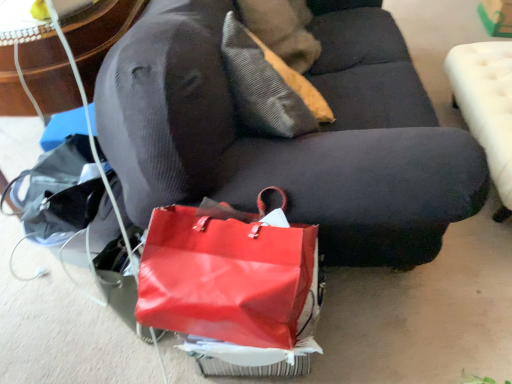
Question: Is textured beige pillow at upper center placed right next to velvet dark gray couch at center?

Choices:
 (A) yes
 (B) no

Answer: (B)

Question: Is textured beige pillow at upper center positioned behind velvet dark gray couch at center?

Choices:
 (A) no
 (B) yes

Answer: (B)

Question: Is velvet dark gray couch at center surrounded by textured beige pillow at upper center?

Choices:
 (A) no
 (B) yes

Answer: (A)

Question: From the image's perspective, does textured beige pillow at upper center appear higher than velvet dark gray couch at center?

Choices:
 (A) no
 (B) yes

Answer: (B)

Question: Is textured beige pillow at upper center taller than velvet dark gray couch at center?

Choices:
 (A) no
 (B) yes

Answer: (A)

Question: In the image, is shiny red handbag at lower center on the left side or the right side of textured beige pillow at upper center?

Choices:
 (A) left
 (B) right

Answer: (A)

Question: From the image's perspective, is shiny red handbag at lower center located above or below textured beige pillow at upper center?

Choices:
 (A) below
 (B) above

Answer: (A)

Question: Is point (210, 336) closer or farther from the camera than point (304, 109)?

Choices:
 (A) farther
 (B) closer

Answer: (B)

Question: Considering the positions of shiny red handbag at lower center and textured beige pillow at upper center in the image, is shiny red handbag at lower center wider or thinner than textured beige pillow at upper center?

Choices:
 (A) wide
 (B) thin

Answer: (A)

Question: Considering the relative positions of textured beige pillow at upper center and velvet dark gray couch at center in the image provided, is textured beige pillow at upper center to the left or to the right of velvet dark gray couch at center?

Choices:
 (A) left
 (B) right

Answer: (A)

Question: Considering the positions of textured beige pillow at upper center and velvet dark gray couch at center in the image, is textured beige pillow at upper center bigger or smaller than velvet dark gray couch at center?

Choices:
 (A) small
 (B) big

Answer: (A)

Question: Considering the positions of textured beige pillow at upper center and velvet dark gray couch at center in the image, is textured beige pillow at upper center taller or shorter than velvet dark gray couch at center?

Choices:
 (A) tall
 (B) short

Answer: (B)

Question: Looking at their shapes, would you say textured beige pillow at upper center is wider or thinner than velvet dark gray couch at center?

Choices:
 (A) wide
 (B) thin

Answer: (B)

Question: Based on their sizes in the image, would you say shiny red handbag at lower center is bigger or smaller than white tufted ottoman at right?

Choices:
 (A) big
 (B) small

Answer: (B)

Question: Is shiny red handbag at lower center inside or outside of white tufted ottoman at right?

Choices:
 (A) inside
 (B) outside

Answer: (B)